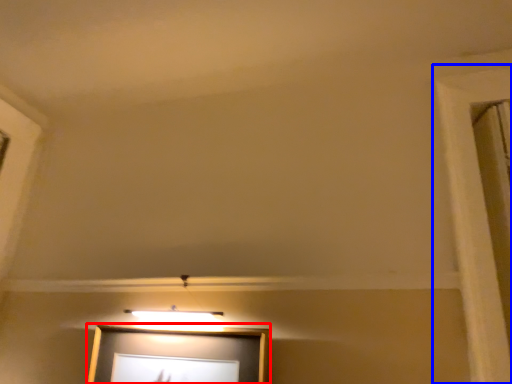
Question: Which of the following is the farthest to the observer, picture frame (highlighted by a red box) or window frame (highlighted by a blue box)?

Choices:
 (A) picture frame
 (B) window frame

Answer: (A)